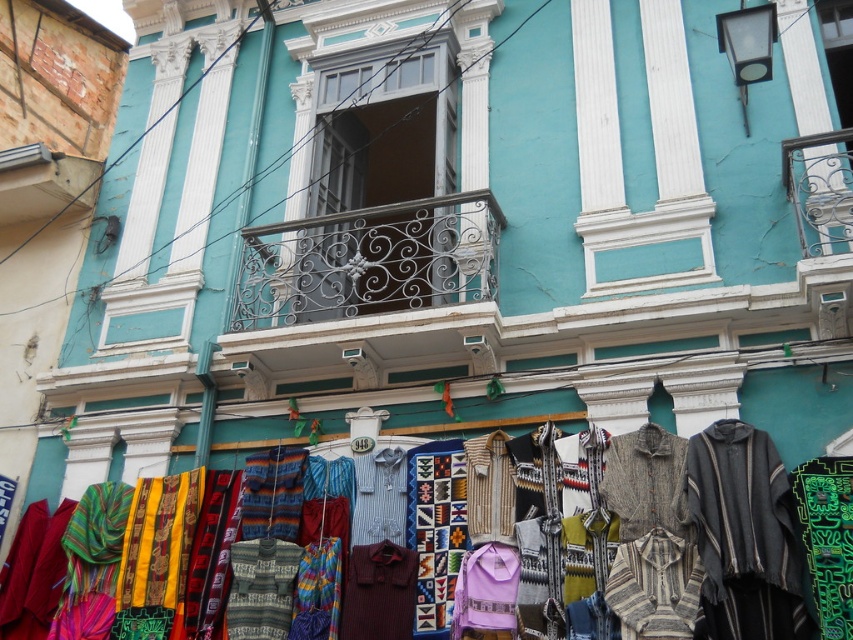
Who is higher up, maroon knitted sweater at center or blue striped shirt at center?

blue striped shirt at center is higher up.

Which is in front, point (369, 563) or point (378, 522)?

Positioned in front is point (369, 563).

The width and height of the screenshot is (853, 640). In order to click on maroon knitted sweater at center in this screenshot , I will do `click(379, 593)`.

Can you confirm if knitted multicolored shawl at center is thinner than maroon knitted sweater at center?

No, knitted multicolored shawl at center is not thinner than maroon knitted sweater at center.

Which is behind, point (747, 516) or point (367, 545)?

Point (367, 545)

You are a GUI agent. You are given a task and a screenshot of the screen. Output one action in this format:
    pyautogui.click(x=<x>, y=<y>)
    Task: Click on the knitted multicolored shawl at center
    
    Given the screenshot: What is the action you would take?
    pyautogui.click(x=711, y=497)

Between maroon knitted sweater at center and purple knit sweater at center, which one has less height?

Standing shorter between the two is purple knit sweater at center.

Between maroon knitted sweater at center and purple knit sweater at center, which one has more height?

Standing taller between the two is maroon knitted sweater at center.

Find the location of a particular element. Image resolution: width=853 pixels, height=640 pixels. maroon knitted sweater at center is located at coordinates (379, 593).